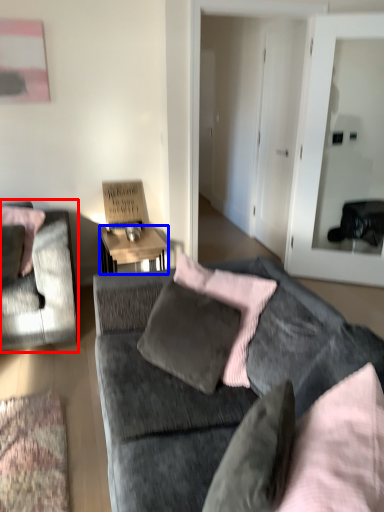
Question: Which object is closer to the camera taking this photo, chair (highlighted by a red box) or desk (highlighted by a blue box)?

Choices:
 (A) chair
 (B) desk

Answer: (A)